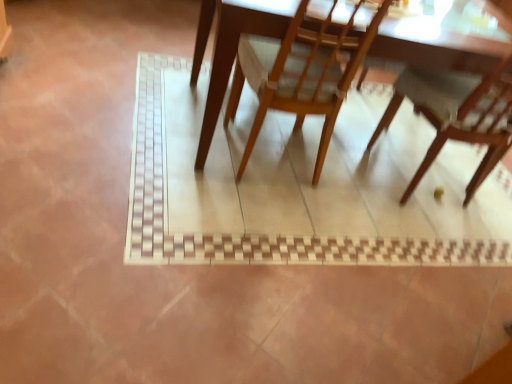
This screenshot has height=384, width=512. Identify the location of wooden table at center. (232, 48).

Can you tell me how much wooden chair at lower right, acting as the first chair starting from the right, and wooden chair at center, which ranks as the 2th chair in right-to-left order, differ in facing direction?

9.49e-05 degrees.

Which object is positioned more to the right, wooden chair at lower right, which is the second chair from left to right, or wooden chair at center, the 1th chair from the left?

From the viewer's perspective, wooden chair at lower right, which is the second chair from left to right, appears more on the right side.

Considering the sizes of objects wooden chair at lower right, which is the second chair from left to right, and wooden chair at center, which ranks as the 2th chair in right-to-left order, in the image provided, who is wider, wooden chair at lower right, which is the second chair from left to right, or wooden chair at center, which ranks as the 2th chair in right-to-left order,?

Wider between the two is wooden chair at lower right, which is the second chair from left to right.

Is the depth of wooden chair at lower right, which is the second chair from left to right, less than that of wooden chair at center, which ranks as the 2th chair in right-to-left order?

No.

Could you measure the distance between wooden chair at lower right, which is the second chair from left to right, and wooden table at center?

wooden chair at lower right, which is the second chair from left to right, is 35.43 inches away from wooden table at center.

Visually, is wooden chair at lower right, acting as the first chair starting from the right, positioned to the left or to the right of wooden table at center?

From the image, it's evident that wooden chair at lower right, acting as the first chair starting from the right, is to the right of wooden table at center.

Is wooden chair at lower right, which is the second chair from left to right, touching wooden table at center?

wooden chair at lower right, which is the second chair from left to right, is not next to wooden table at center, and they're not touching.

From a real-world perspective, which object rests below the other?

wooden table at center.

Is wooden table at center positioned with its back to wooden chair at center, the 1th chair from the left?

Yes, wooden table at center is positioned with its back facing wooden chair at center, the 1th chair from the left.

In the scene shown: Do you think wooden table at center is within wooden chair at center, which ranks as the 2th chair in right-to-left order, or outside of it?

The correct answer is: outside.

From a real-world perspective, is wooden table at center beneath wooden chair at center, the 1th chair from the left?

Yes.

Can you confirm if wooden table at center is wider than wooden chair at center, which ranks as the 2th chair in right-to-left order?

Correct, the width of wooden table at center exceeds that of wooden chair at center, which ranks as the 2th chair in right-to-left order.

Is wooden chair at center, which ranks as the 2th chair in right-to-left order, taller than wooden chair at lower right, acting as the first chair starting from the right?

Incorrect, the height of wooden chair at center, which ranks as the 2th chair in right-to-left order, is not larger of that of wooden chair at lower right, acting as the first chair starting from the right.

Which is nearer, (312, 75) or (483, 168)?

The point (312, 75) is in front.

Which object is positioned more to the left, wooden chair at center, the 1th chair from the left, or wooden chair at lower right, acting as the first chair starting from the right?

wooden chair at center, the 1th chair from the left, is more to the left.

Looking at this image, would you consider wooden chair at center, the 1th chair from the left, to be distant from wooden chair at lower right, which is the second chair from left to right?

No, wooden chair at center, the 1th chair from the left, is in close proximity to wooden chair at lower right, which is the second chair from left to right.

Where is `chair that is the 1st one when counting downward from the wooden table at center (from the image's perspective)`? The width and height of the screenshot is (512, 384). chair that is the 1st one when counting downward from the wooden table at center (from the image's perspective) is located at coordinates (300, 73).

Which object is positioned more to the right, wooden chair at center, which ranks as the 2th chair in right-to-left order, or wooden table at center?

Positioned to the right is wooden table at center.

From the picture: Is wooden chair at center, which ranks as the 2th chair in right-to-left order, taller than wooden table at center?

Yes, wooden chair at center, which ranks as the 2th chair in right-to-left order, is taller than wooden table at center.

From the image's perspective, is wooden chair at center, which ranks as the 2th chair in right-to-left order, above wooden table at center?

No, from the image's perspective, wooden chair at center, which ranks as the 2th chair in right-to-left order, is not on top of wooden table at center.

Based on their sizes in the image, would you say wooden table at center is bigger or smaller than wooden chair at lower right, acting as the first chair starting from the right?

In the image, wooden table at center appears to be larger than wooden chair at lower right, acting as the first chair starting from the right.

Between wooden table at center and wooden chair at lower right, acting as the first chair starting from the right, which one has more height?

Standing taller between the two is wooden chair at lower right, acting as the first chair starting from the right.

In terms of width, does wooden table at center look wider or thinner when compared to wooden chair at lower right, acting as the first chair starting from the right?

In the image, wooden table at center appears to be wider than wooden chair at lower right, acting as the first chair starting from the right.

Is point (210, 20) closer to camera compared to point (449, 125)?

Yes, point (210, 20) is closer to viewer.

The width and height of the screenshot is (512, 384). I want to click on chair located on the left of wooden chair at lower right, acting as the first chair starting from the right, so click(x=300, y=73).

Find the location of a particular element. the 1st chair in front of the wooden table at center is located at coordinates pyautogui.click(x=457, y=114).

Based on their spatial positions, is wooden table at center or wooden chair at center, which ranks as the 2th chair in right-to-left order, closer to wooden chair at lower right, acting as the first chair starting from the right?

Among the two, wooden chair at center, which ranks as the 2th chair in right-to-left order, is located nearer to wooden chair at lower right, acting as the first chair starting from the right.

Estimate the real-world distances between objects in this image. Which object is closer to wooden chair at center, the 1th chair from the left, wooden chair at lower right, acting as the first chair starting from the right, or wooden table at center?

wooden table at center is positioned closer to the anchor wooden chair at center, the 1th chair from the left.

Estimate the real-world distances between objects in this image. Which object is closer to wooden table at center, wooden chair at center, the 1th chair from the left, or wooden chair at lower right, acting as the first chair starting from the right?

The object closer to wooden table at center is wooden chair at center, the 1th chair from the left.

When comparing their distances from wooden table at center, does wooden chair at lower right, which is the second chair from left to right, or wooden chair at center, which ranks as the 2th chair in right-to-left order, seem closer?

wooden chair at center, which ranks as the 2th chair in right-to-left order, is positioned closer to the anchor wooden table at center.

Considering their positions, is wooden table at center positioned further to wooden chair at center, which ranks as the 2th chair in right-to-left order, than wooden chair at lower right, which is the second chair from left to right?

wooden chair at lower right, which is the second chair from left to right, lies further to wooden chair at center, which ranks as the 2th chair in right-to-left order, than the other object.

Based on their spatial positions, is wooden chair at center, the 1th chair from the left, or wooden table at center further from wooden chair at lower right, acting as the first chair starting from the right?

wooden table at center lies further to wooden chair at lower right, acting as the first chair starting from the right, than the other object.

Identify the location of table located between wooden chair at center, which ranks as the 2th chair in right-to-left order, and wooden chair at lower right, acting as the first chair starting from the right, in the left-right direction. The width and height of the screenshot is (512, 384). (232, 48).